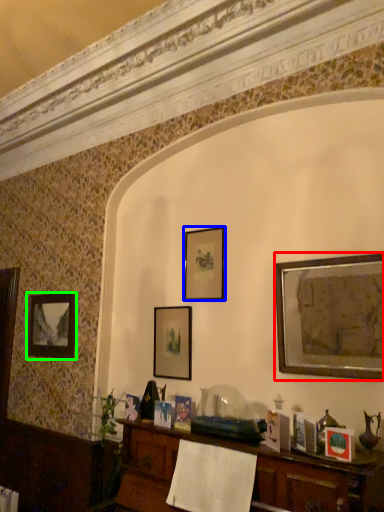
Question: Which is nearer to the picture frame (highlighted by a red box)? picture frame (highlighted by a blue box) or picture frame (highlighted by a green box).

Choices:
 (A) picture frame
 (B) picture frame

Answer: (A)